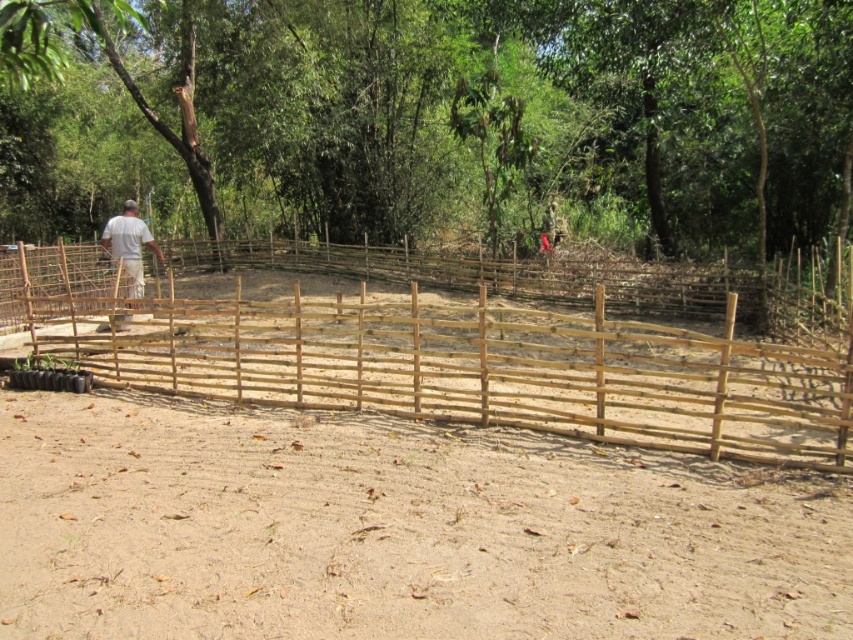
Question: Is brown wood fence at center to the left of natural wood fence at center from the viewer's perspective?

Choices:
 (A) no
 (B) yes

Answer: (B)

Question: Based on their relative distances, which object is nearer to the natural wood fence at center?

Choices:
 (A) white wood person at left
 (B) brown sandy dirt field at center

Answer: (A)

Question: Which object appears closest to the camera in this image?

Choices:
 (A) white wood person at left
 (B) natural wood fence at center
 (C) brown wood fence at center
 (D) brown sandy dirt field at center

Answer: (D)

Question: Can you confirm if brown sandy dirt field at center is positioned above white wood person at left?

Choices:
 (A) yes
 (B) no

Answer: (B)

Question: Can you confirm if brown sandy dirt field at center is positioned to the left of white wood person at left?

Choices:
 (A) no
 (B) yes

Answer: (A)

Question: Among these points, which one is farthest from the camera?

Choices:
 (A) (363, 152)
 (B) (194, 310)
 (C) (202, 593)

Answer: (A)